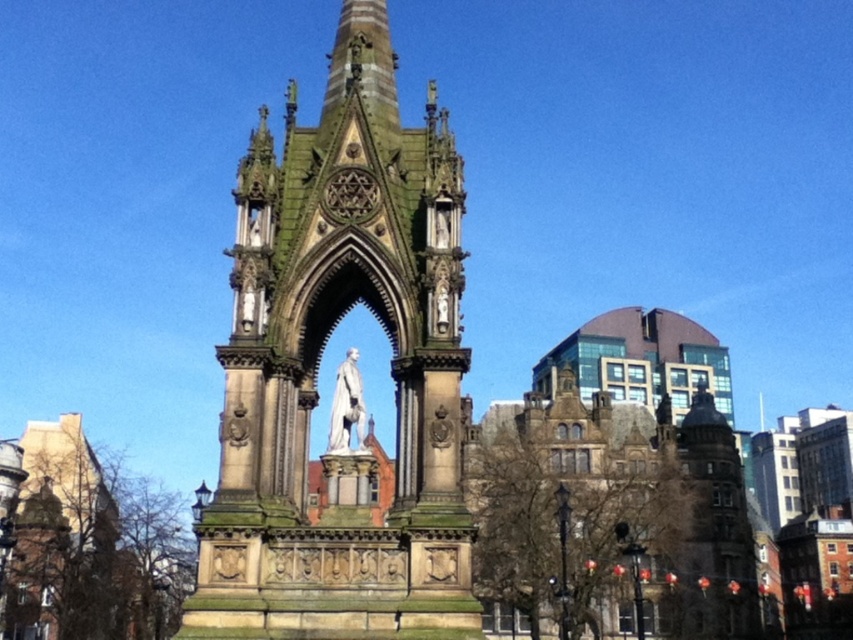
You are a tourist standing in front of the monument. You notice the green stone tower at center and the white marble statue at center. Which one is closer to you?

The green stone tower at center is closer to you since it is in front of the white marble statue at center.

You are a city planner assessing the monument in the public square. You need to install a new lighting system that can illuminate both the green stone tower at center and the white marble statue at center. Considering their sizes, which one requires a taller lighting pole to ensure proper illumination?

The green stone tower at center has a larger size compared to the white marble statue at center, so it requires a taller lighting pole to ensure proper illumination.